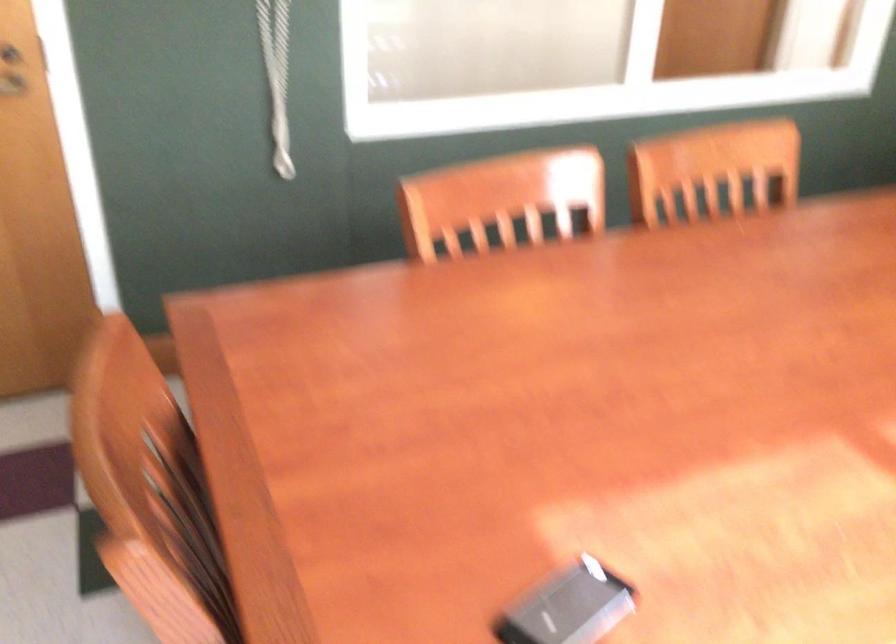
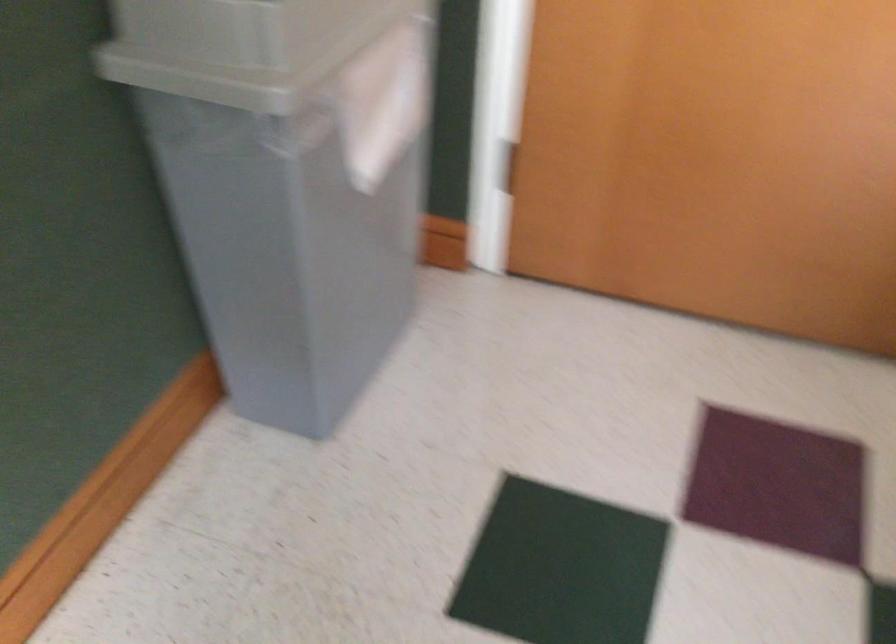
How did the camera likely rotate?

The rotation direction of the camera is left-down.